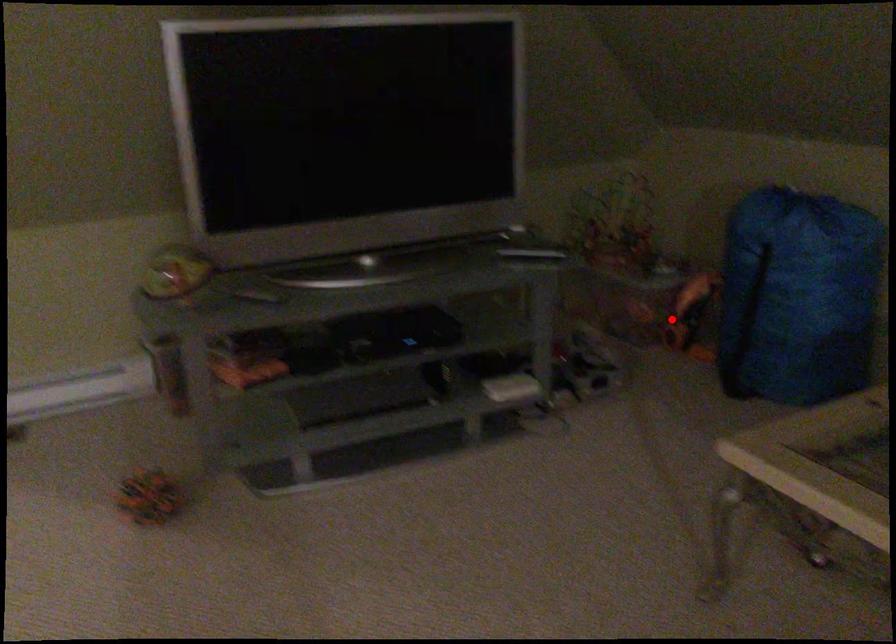
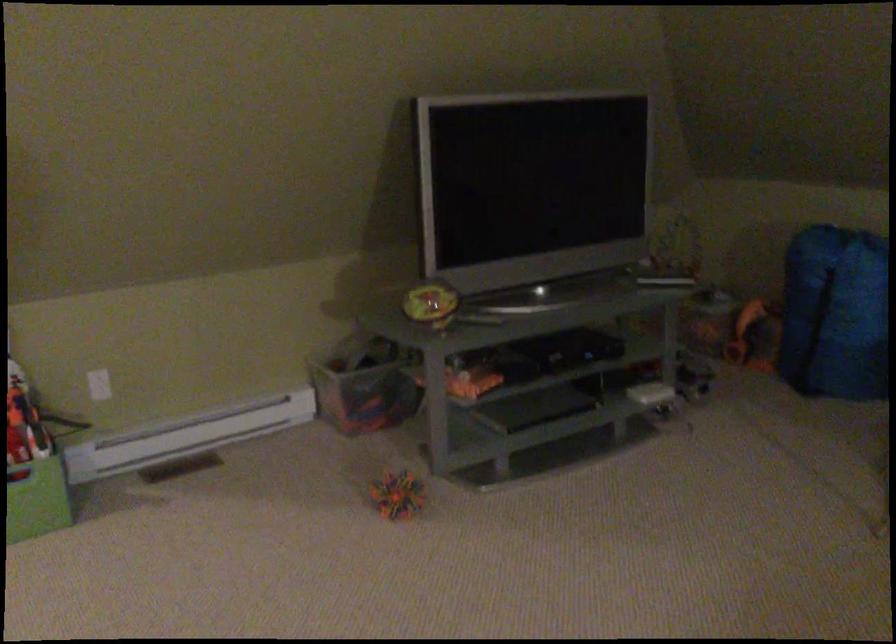
Question: I am providing you with two images of the same scene from different viewpoints. Image1 has a red point marked. In image2, the corresponding 3D location appears at what relative position? Reply with the corresponding letter.

Choices:
 (A) Closer
 (B) Farther

Answer: (B)